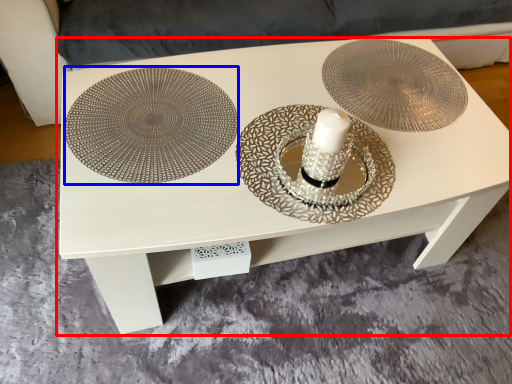
Question: Which object appears farthest to the camera in this image, table (highlighted by a red box) or place mat (highlighted by a blue box)?

Choices:
 (A) table
 (B) place mat

Answer: (B)